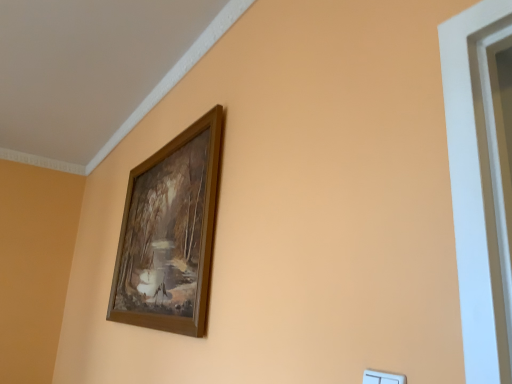
Question: In terms of size, does wooden frame at upper center appear bigger or smaller than white plastic light switch at lower right?

Choices:
 (A) small
 (B) big

Answer: (B)

Question: Choose the correct answer: Is wooden frame at upper center inside white plastic light switch at lower right or outside it?

Choices:
 (A) inside
 (B) outside

Answer: (B)

Question: Is wooden frame at upper center in front of or behind white plastic light switch at lower right in the image?

Choices:
 (A) front
 (B) behind

Answer: (B)

Question: Is point (396, 382) closer or farther from the camera than point (197, 226)?

Choices:
 (A) farther
 (B) closer

Answer: (B)

Question: Is white plastic light switch at lower right taller or shorter than wooden frame at upper center?

Choices:
 (A) short
 (B) tall

Answer: (A)

Question: In the image, is white plastic light switch at lower right positioned in front of or behind wooden frame at upper center?

Choices:
 (A) behind
 (B) front

Answer: (B)

Question: Looking at the image, does white plastic light switch at lower right seem bigger or smaller compared to wooden frame at upper center?

Choices:
 (A) small
 (B) big

Answer: (A)